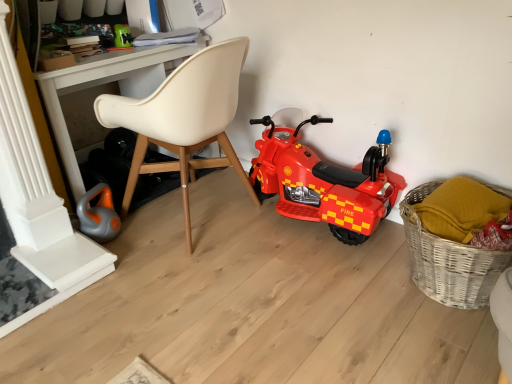
This screenshot has height=384, width=512. Find the location of `vacant area that lies between orange rubber toy at lower left, which is the 1th toy in bottom-to-top order, and beige leather chair at center`. vacant area that lies between orange rubber toy at lower left, which is the 1th toy in bottom-to-top order, and beige leather chair at center is located at coordinates (147, 244).